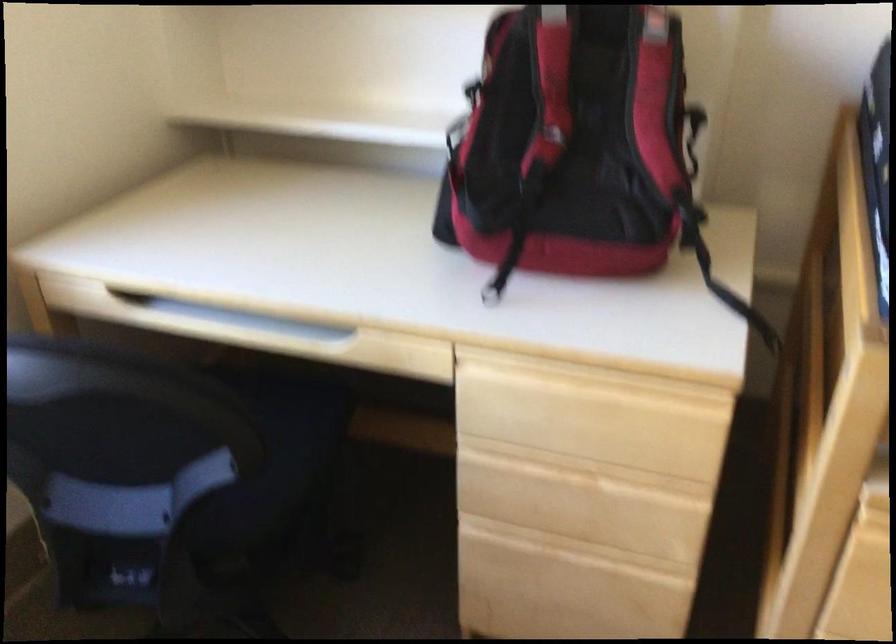
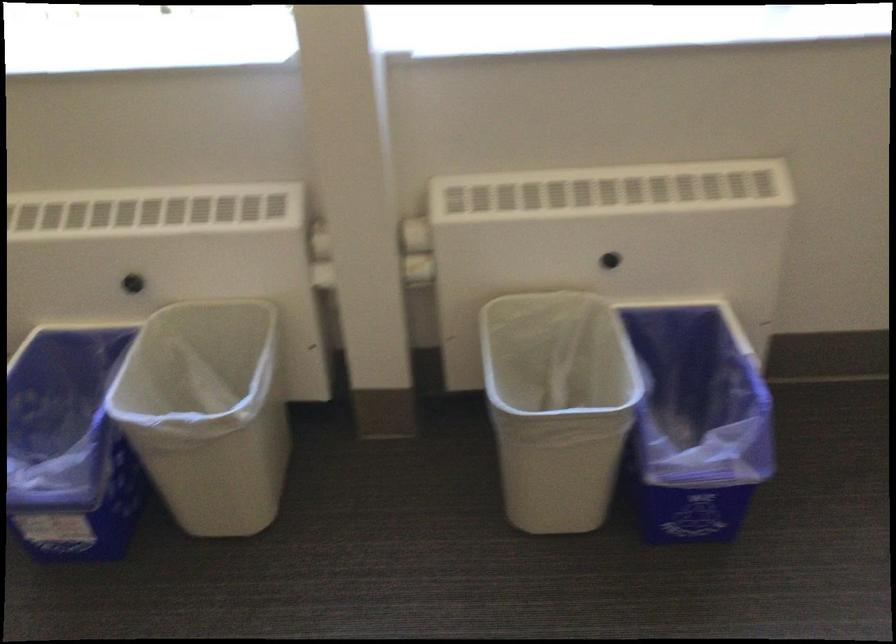
First-person continuous shooting, in which direction is the camera rotating?

The rotation direction of the camera is left-down.